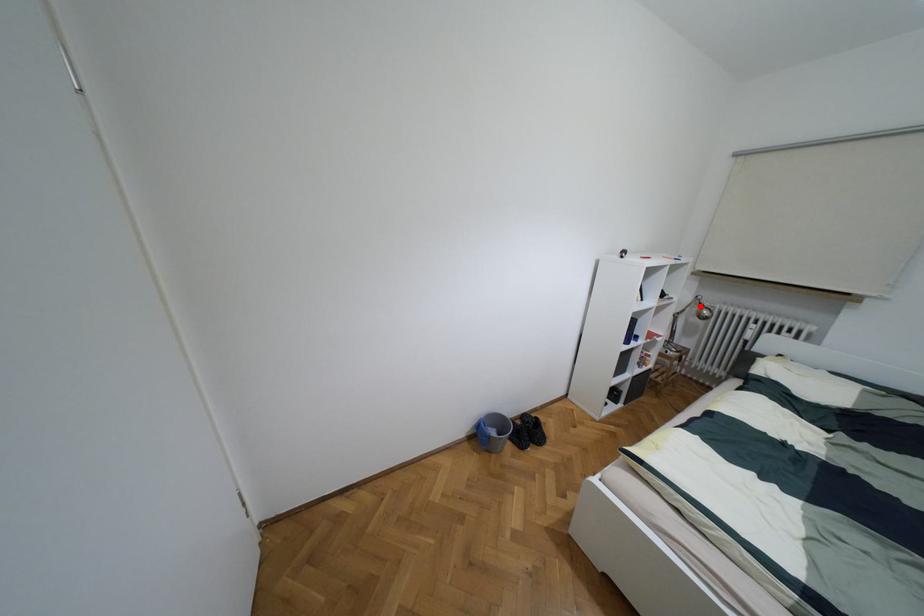
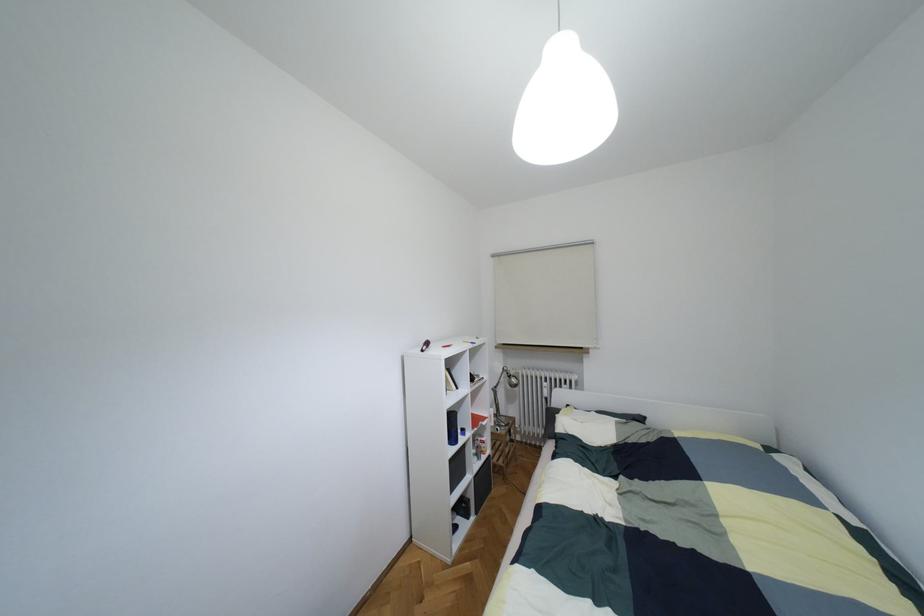
Question: A red point is marked in image1. In image2, is the corresponding 3D point closer to the camera or farther? Reply with the corresponding letter.

Choices:
 (A) The corresponding 3D point is closer.
 (B) The corresponding 3D point is farther.

Answer: (B)